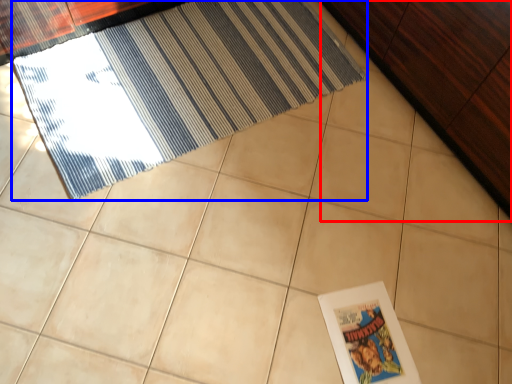
Question: Which point is closer to the camera, dresser (highlighted by a red box) or door (highlighted by a blue box)?

Choices:
 (A) dresser
 (B) door

Answer: (A)